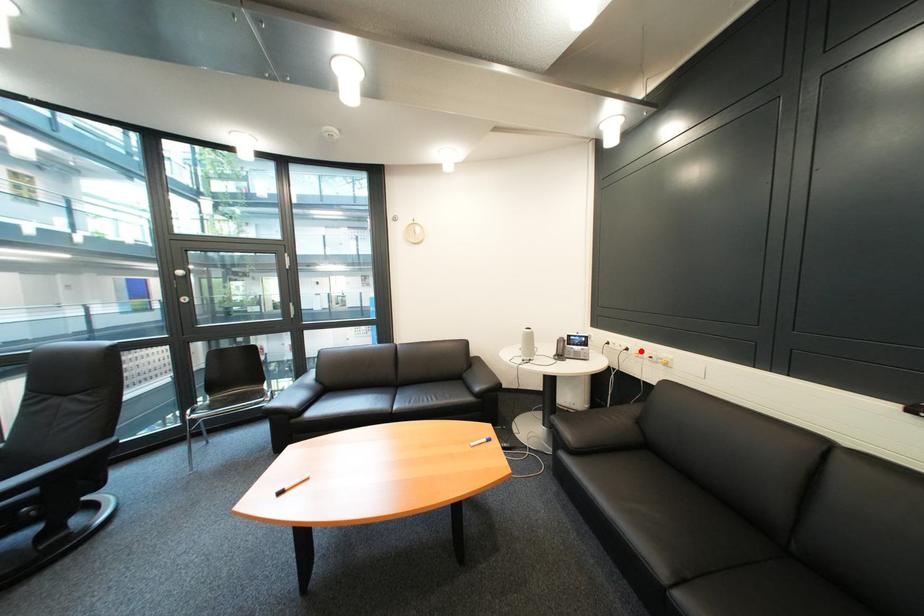
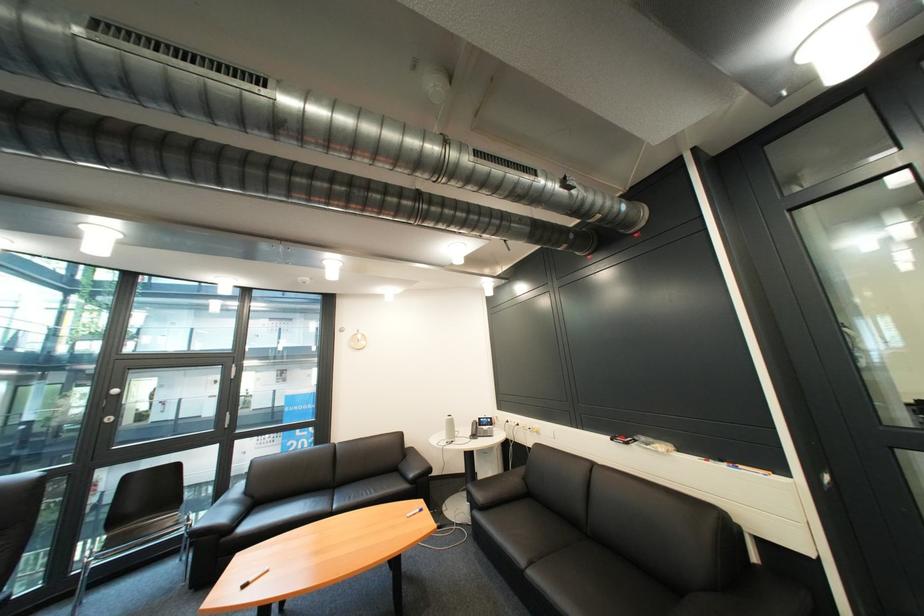
Find the pixel in the second image that matches the highlighted location in the first image.

(531, 426)